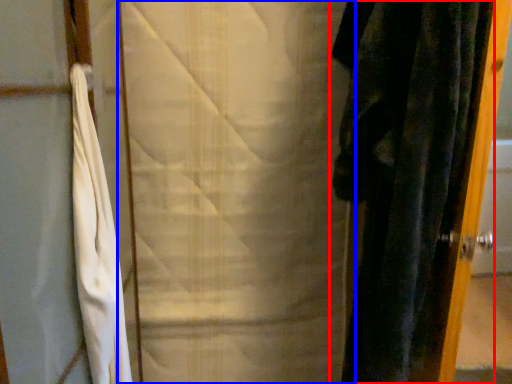
Question: Among these objects, which one is farthest to the camera, curtain (highlighted by a red box) or curtain (highlighted by a blue box)?

Choices:
 (A) curtain
 (B) curtain

Answer: (B)